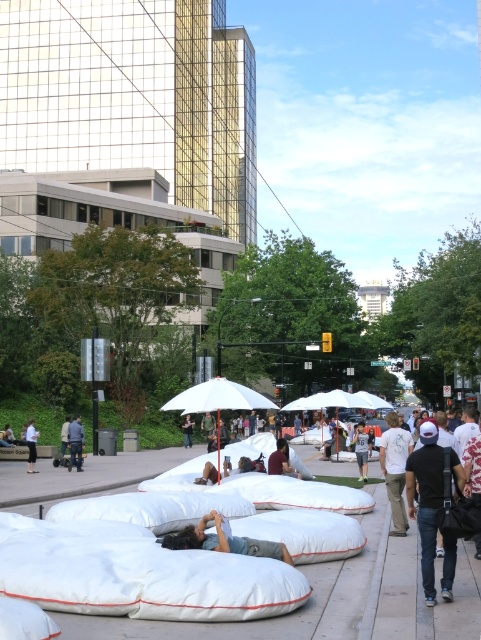
Question: From the image, what is the correct spatial relationship of blue denim jeans at center in relation to denim jacket at center?

Choices:
 (A) above
 (B) below

Answer: (A)

Question: From the image, what is the correct spatial relationship of white fabric cushions at lower left in relation to blue denim jeans at center?

Choices:
 (A) above
 (B) below

Answer: (B)

Question: Which of the following is the farthest from the observer?

Choices:
 (A) (367, 452)
 (B) (281, 436)

Answer: (B)

Question: Which point is farther to the camera?

Choices:
 (A) (379, 556)
 (B) (80, 451)
 (C) (366, 452)
 (D) (32, 461)

Answer: (B)

Question: Which of the following is the farthest from the observer?

Choices:
 (A) (172, 541)
 (B) (77, 634)
 (C) (278, 461)
 (D) (354, 440)

Answer: (D)

Question: Is white fabric cushions at lower left positioned in front of denim pants at center?

Choices:
 (A) yes
 (B) no

Answer: (A)